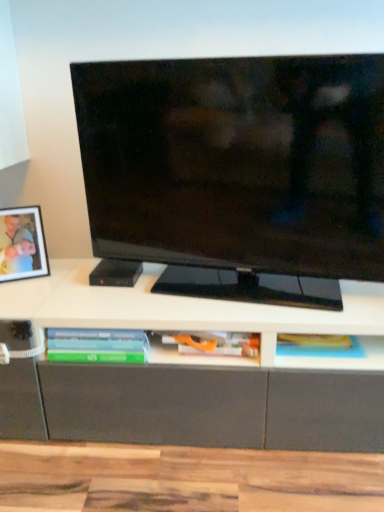
Question: Would you say translucent plastic book at lower center, arranged as the first book when viewed from the left, is part of matte black tv at center's contents?

Choices:
 (A) yes
 (B) no

Answer: (B)

Question: Is matte black tv at center looking in the opposite direction of translucent plastic book at lower center, arranged as the first book when viewed from the left?

Choices:
 (A) no
 (B) yes

Answer: (A)

Question: Is matte black tv at center smaller than translucent plastic book at lower center, the 2th book viewed from the right?

Choices:
 (A) no
 (B) yes

Answer: (A)

Question: Is matte black tv at center bigger than translucent plastic book at lower center, arranged as the first book when viewed from the left?

Choices:
 (A) yes
 (B) no

Answer: (A)

Question: Is matte black tv at center shorter than translucent plastic book at lower center, the 2th book viewed from the right?

Choices:
 (A) no
 (B) yes

Answer: (A)

Question: Does matte black tv at center have a greater width compared to translucent plastic book at lower center, arranged as the first book when viewed from the left?

Choices:
 (A) yes
 (B) no

Answer: (B)

Question: Considering the relative sizes of matte black picture frame at left and matte orange book at center, the second book when ordered from left to right, in the image provided, is matte black picture frame at left wider than matte orange book at center, the second book when ordered from left to right,?

Choices:
 (A) no
 (B) yes

Answer: (A)

Question: Is matte black picture frame at left further to camera compared to matte orange book at center, the second book when ordered from left to right?

Choices:
 (A) yes
 (B) no

Answer: (A)

Question: Does matte black picture frame at left have a lesser height compared to matte orange book at center, the 1th book in the right-to-left sequence?

Choices:
 (A) no
 (B) yes

Answer: (A)

Question: Does matte black picture frame at left have a smaller size compared to matte orange book at center, the 1th book in the right-to-left sequence?

Choices:
 (A) no
 (B) yes

Answer: (A)

Question: Can matte orange book at center, the second book when ordered from left to right, be found inside matte black picture frame at left?

Choices:
 (A) yes
 (B) no

Answer: (B)

Question: Is the position of matte black picture frame at left less distant than that of matte orange book at center, the second book when ordered from left to right?

Choices:
 (A) yes
 (B) no

Answer: (B)

Question: Is matte orange book at center, the 1th book in the right-to-left sequence, beside matte black picture frame at left?

Choices:
 (A) yes
 (B) no

Answer: (B)